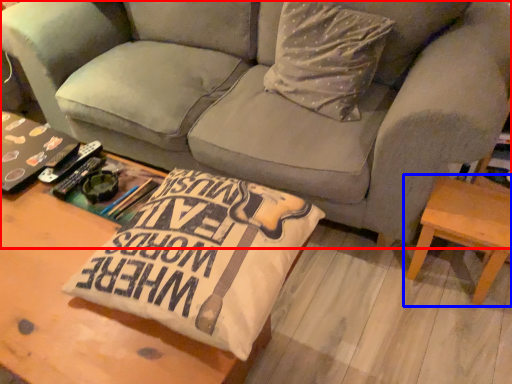
Question: Which object appears farthest to the camera in this image, studio couch (highlighted by a red box) or table (highlighted by a blue box)?

Choices:
 (A) studio couch
 (B) table

Answer: (B)